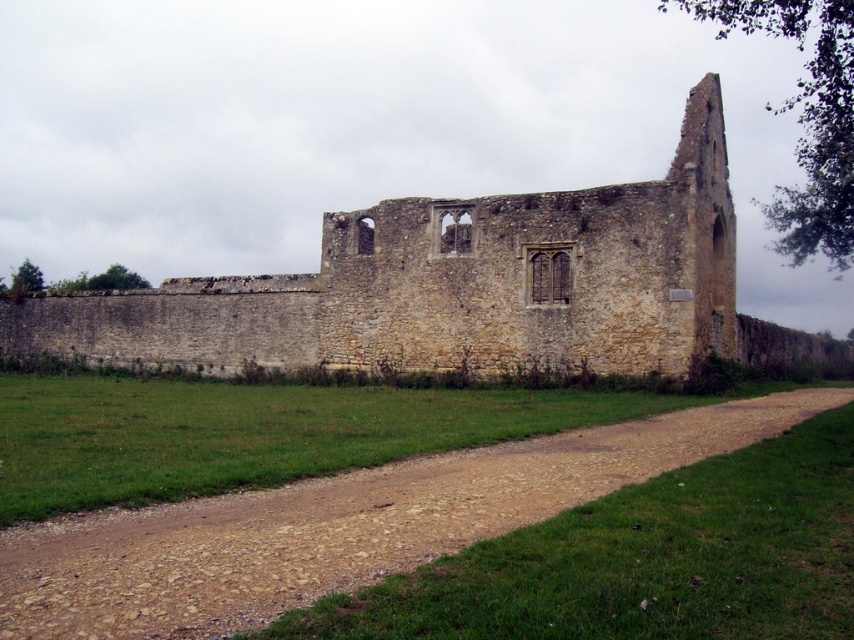
Question: Can you confirm if yellow stone ruins at center is positioned to the left of dirt/gravel path at lower center?

Choices:
 (A) no
 (B) yes

Answer: (B)

Question: Among these points, which one is farthest from the camera?

Choices:
 (A) pos(149,624)
 (B) pos(63,300)

Answer: (B)

Question: Which of the following is the farthest from the observer?

Choices:
 (A) (366, 355)
 (B) (360, 518)

Answer: (A)

Question: Is yellow stone ruins at center smaller than dirt/gravel path at lower center?

Choices:
 (A) no
 (B) yes

Answer: (A)

Question: Is yellow stone ruins at center behind dirt/gravel path at lower center?

Choices:
 (A) no
 (B) yes

Answer: (B)